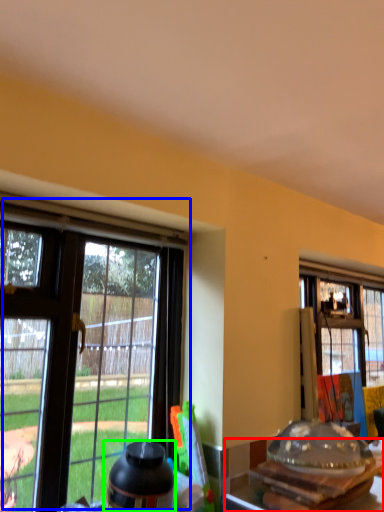
Question: Which object is positioned closest to kitchen & dining room table (highlighted by a red box)? Select from window (highlighted by a blue box) and bottle (highlighted by a green box).

Choices:
 (A) window
 (B) bottle

Answer: (B)